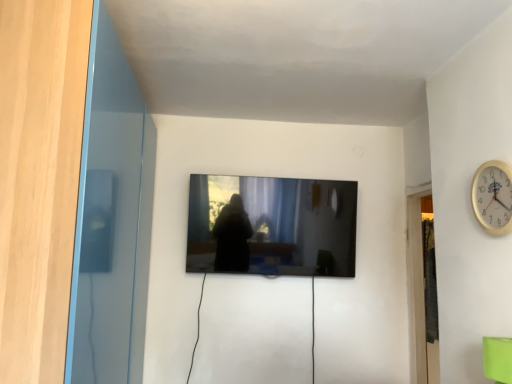
Question: Is gold metallic wall clock at upper right oriented towards matte black tv at center?

Choices:
 (A) no
 (B) yes

Answer: (A)

Question: Is the surface of gold metallic wall clock at upper right in direct contact with matte black tv at center?

Choices:
 (A) no
 (B) yes

Answer: (A)

Question: Is the position of gold metallic wall clock at upper right more distant than that of matte black tv at center?

Choices:
 (A) yes
 (B) no

Answer: (B)

Question: From the image's perspective, is gold metallic wall clock at upper right over matte black tv at center?

Choices:
 (A) no
 (B) yes

Answer: (B)

Question: Is matte black tv at center at the back of gold metallic wall clock at upper right?

Choices:
 (A) yes
 (B) no

Answer: (B)

Question: From a real-world perspective, is matte black tv at center above or below transparent glass door at left?

Choices:
 (A) below
 (B) above

Answer: (B)

Question: Do you think matte black tv at center is within transparent glass door at left, or outside of it?

Choices:
 (A) inside
 (B) outside

Answer: (B)

Question: Considering the positions of matte black tv at center and transparent glass door at left in the image, is matte black tv at center wider or thinner than transparent glass door at left?

Choices:
 (A) thin
 (B) wide

Answer: (A)

Question: Relative to transparent glass door at left, is matte black tv at center in front or behind?

Choices:
 (A) behind
 (B) front

Answer: (A)

Question: Is green matte cup at lower right taller or shorter than matte black tv at center?

Choices:
 (A) tall
 (B) short

Answer: (B)

Question: Considering the positions of green matte cup at lower right and matte black tv at center in the image, is green matte cup at lower right wider or thinner than matte black tv at center?

Choices:
 (A) thin
 (B) wide

Answer: (A)

Question: Is point (496, 355) closer or farther from the camera than point (198, 238)?

Choices:
 (A) farther
 (B) closer

Answer: (B)

Question: From the image's perspective, is green matte cup at lower right located above or below matte black tv at center?

Choices:
 (A) below
 (B) above

Answer: (A)

Question: From the image's perspective, is transparent glass door at left above or below matte black tv at center?

Choices:
 (A) below
 (B) above

Answer: (A)

Question: Is transparent glass door at left inside or outside of matte black tv at center?

Choices:
 (A) outside
 (B) inside

Answer: (A)